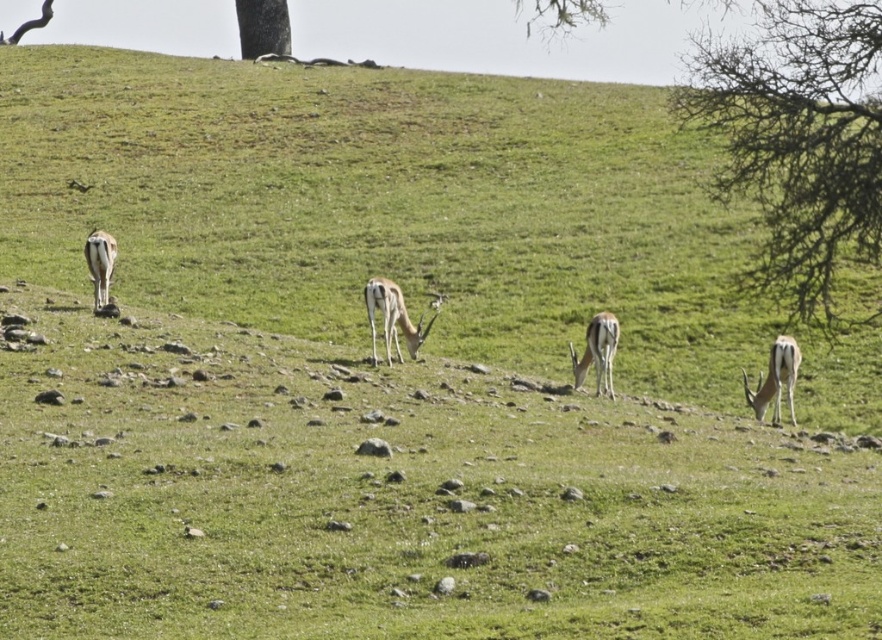
Between bare branches at upper right and smooth brown antelope at right, which one appears on the right side from the viewer's perspective?

bare branches at upper right is more to the right.

Is point (847, 161) positioned behind point (778, 353)?

No, (847, 161) is closer to viewer.

You are a GUI agent. You are given a task and a screenshot of the screen. Output one action in this format:
    pyautogui.click(x=<x>, y=<y>)
    Task: Click on the bare branches at upper right
    
    Given the screenshot: What is the action you would take?
    pyautogui.click(x=797, y=141)

Which of these two, smooth brown antelope at right or shiny brown antelope at center, stands taller?

Standing taller between the two is shiny brown antelope at center.

Is smooth brown antelope at right taller than shiny brown antelope at center?

No, smooth brown antelope at right is not taller than shiny brown antelope at center.

Is point (771, 376) more distant than point (573, 374)?

No, (771, 376) is in front of (573, 374).

The image size is (882, 640). I want to click on smooth brown antelope at right, so click(x=775, y=380).

What do you see at coordinates (797, 141) in the screenshot? I see `bare branches at upper right` at bounding box center [797, 141].

Can you confirm if bare branches at upper right is taller than smooth brown antelope at center?

Correct, bare branches at upper right is much taller as smooth brown antelope at center.

Who is more forward, (879, 246) or (415, 352)?

Point (879, 246)

This screenshot has height=640, width=882. I want to click on bare branches at upper right, so click(x=797, y=141).